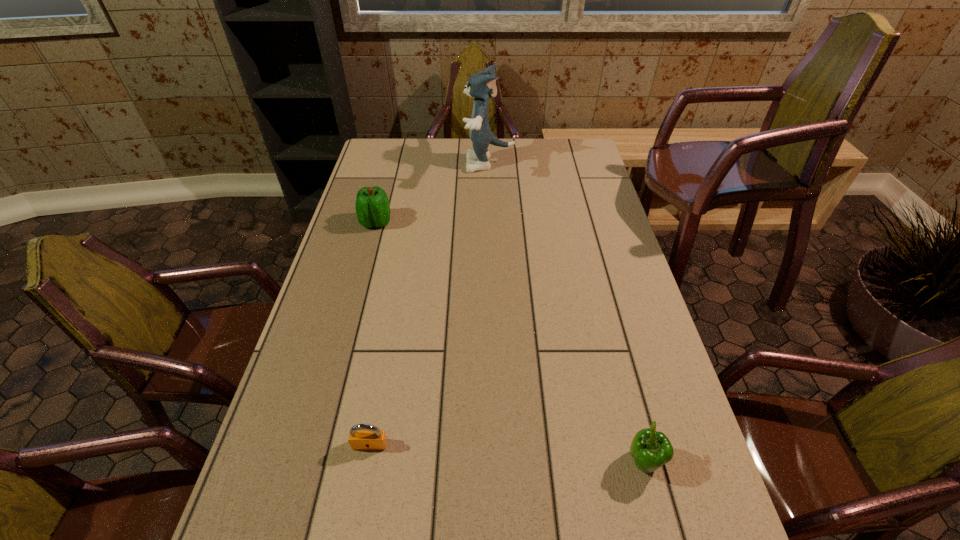
Identify the location of free space located on the front-facing side of the second object from right to left. (433, 164).

At what (x,y) coordinates should I click in order to perform the action: click on free space located 0.290m on the back of the second farthest object. Please return your answer as a coordinate pair (x, y). Image resolution: width=960 pixels, height=540 pixels. Looking at the image, I should click on (391, 168).

Find the location of a particular element. The image size is (960, 540). free spot located on the left of the nearer bell pepper is located at coordinates coord(497,463).

Identify the location of free location located 0.050m to unlock the shortest object from the front. This screenshot has width=960, height=540. (365, 474).

Where is `object that is at the far edge`? object that is at the far edge is located at coordinates (482, 85).

The width and height of the screenshot is (960, 540). In order to click on object located at the left edge in this screenshot , I will do `click(372, 205)`.

The width and height of the screenshot is (960, 540). In order to click on object present at the right edge in this screenshot , I will do `click(650, 449)`.

The height and width of the screenshot is (540, 960). In the image, there is a desktop. In order to click on vacant space at the far edge in this screenshot , I will do `click(524, 163)`.

Find the location of a particular element. The image size is (960, 540). vacant space at the left edge of the desktop is located at coordinates (332, 361).

This screenshot has width=960, height=540. In order to click on vacant space at the right edge of the desktop in this screenshot , I will do `click(565, 194)`.